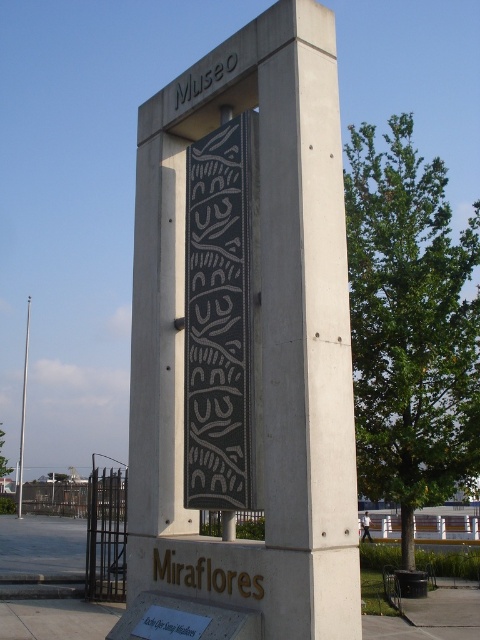
In the scene shown: Is gold metallic sign at lower center thinner than gray concrete sign at upper center?

In fact, gold metallic sign at lower center might be wider than gray concrete sign at upper center.

Measure the distance between gold metallic sign at lower center and camera.

A distance of 15.42 feet exists between gold metallic sign at lower center and camera.

You are a GUI agent. You are given a task and a screenshot of the screen. Output one action in this format:
    pyautogui.click(x=<x>, y=<y>)
    Task: Click on the gold metallic sign at lower center
    The height and width of the screenshot is (640, 480).
    Given the screenshot: What is the action you would take?
    pyautogui.click(x=205, y=576)

Can you confirm if black textured stone at center is positioned above gold metallic text at lower center?

Yes, black textured stone at center is above gold metallic text at lower center.

Does black textured stone at center appear on the right side of gold metallic text at lower center?

Yes, black textured stone at center is to the right of gold metallic text at lower center.

Is point (208, 212) less distant than point (143, 634)?

No.

Identify the location of black textured stone at center. 219,317.

What do you see at coordinates (169, 625) in the screenshot?
I see `gold metallic text at lower center` at bounding box center [169, 625].

Which is in front, point (194, 630) or point (208, 68)?

Positioned in front is point (194, 630).

I want to click on gold metallic text at lower center, so click(x=169, y=625).

The width and height of the screenshot is (480, 640). Find the location of `gold metallic text at lower center`. gold metallic text at lower center is located at coordinates (169, 625).